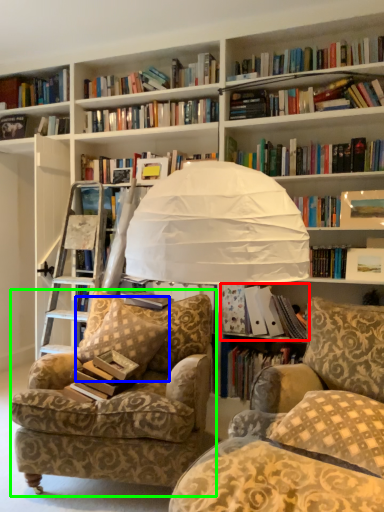
Question: Which object is the closest to the book (highlighted by a red box)? Choose among these: pillow (highlighted by a blue box) or chair (highlighted by a green box).

Choices:
 (A) pillow
 (B) chair

Answer: (A)